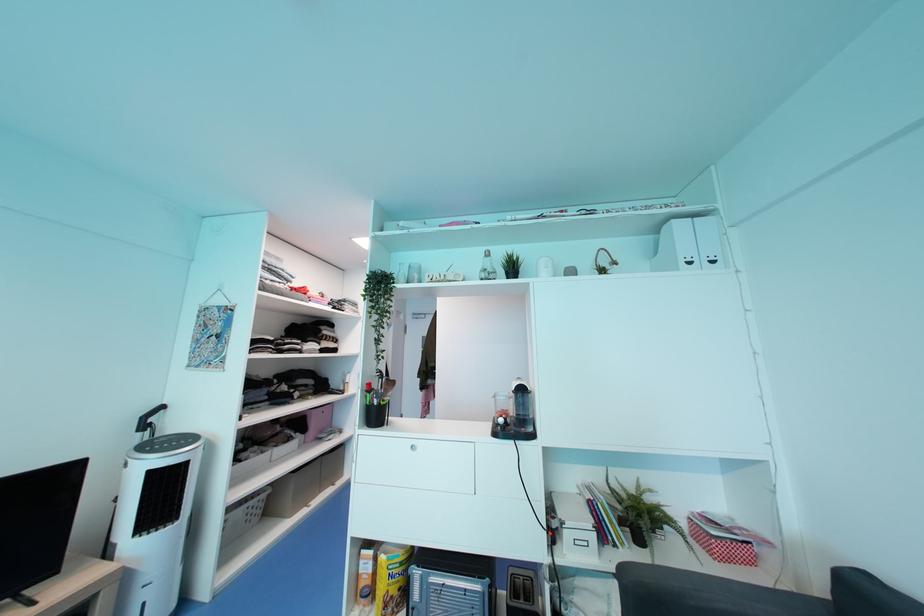
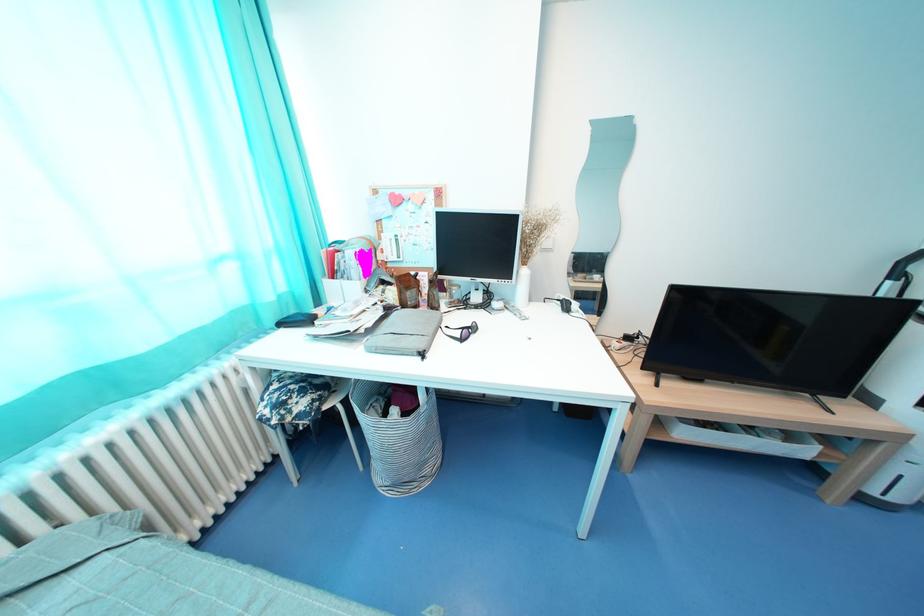
How did the camera likely rotate?

The rotation direction of the camera is left-down.